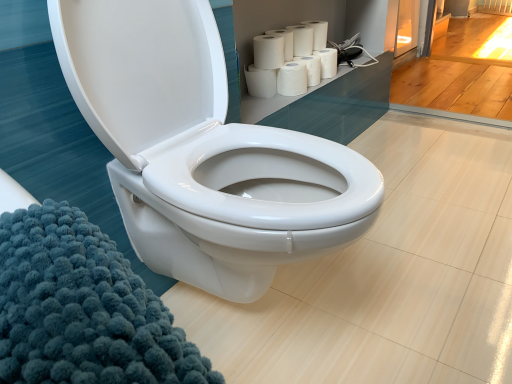
Describe the element at coordinates (311, 69) in the screenshot. I see `white matte paper towel at upper right, which is the third paper towel from bottom to top` at that location.

Locate an element on the screen. The width and height of the screenshot is (512, 384). white matte paper towel at upper center, which appears as the 5th paper towel when viewed from the top is located at coordinates (292, 79).

Locate an element on the screen. The height and width of the screenshot is (384, 512). white matte toilet paper at upper right, arranged as the 1th toilet paper when ordered from the bottom is located at coordinates (327, 62).

What do you see at coordinates (284, 41) in the screenshot? This screenshot has width=512, height=384. I see `white matte paper towel at upper center, the 2th paper towel when ordered from top to bottom` at bounding box center [284, 41].

You are a GUI agent. You are given a task and a screenshot of the screen. Output one action in this format:
    pyautogui.click(x=<x>, y=<y>)
    Task: Click on the white matte paper towel at upper right, which is counted as the 1th paper towel, starting from the bottom
    The width and height of the screenshot is (512, 384).
    Given the screenshot: What is the action you would take?
    pyautogui.click(x=261, y=81)

The image size is (512, 384). Describe the element at coordinates (318, 33) in the screenshot. I see `white matte toilet paper at upper center, which is the first toilet paper from top to bottom` at that location.

You are a GUI agent. You are given a task and a screenshot of the screen. Output one action in this format:
    pyautogui.click(x=<x>, y=<y>)
    Task: Click on the white glossy toilet at center
    Image resolution: width=512 pixels, height=384 pixels.
    Given the screenshot: What is the action you would take?
    pyautogui.click(x=203, y=151)

Can you tell me how much white matte paper towel at upper center, which appears as the 5th paper towel when viewed from the top, and white matte paper towel at upper center, placed as the 1th paper towel when sorted from top to bottom, differ in facing direction?

The angular difference between white matte paper towel at upper center, which appears as the 5th paper towel when viewed from the top, and white matte paper towel at upper center, placed as the 1th paper towel when sorted from top to bottom, is 0.000318 degrees.

From a real-world perspective, starting from the white matte paper towel at upper center, which is the second paper towel in bottom-to-top order, which paper towel is the 3rd one vertically above it? Please provide its 2D coordinates.

[(302, 40)]

Is white matte paper towel at upper center, placed as the 1th paper towel when sorted from top to bottom, at the back of white matte paper towel at upper center, which appears as the 5th paper towel when viewed from the top?

No.

Is white matte paper towel at upper right, marked as the sixth paper towel in a top-to-bottom arrangement, positioned far away from white matte paper towel at upper center, which is the second paper towel in bottom-to-top order?

They are positioned close to each other.

From a real-world perspective, which object rests below the other?

In real-world perspective, white matte paper towel at upper right, marked as the sixth paper towel in a top-to-bottom arrangement, is lower.

Can you confirm if white matte paper towel at upper right, marked as the sixth paper towel in a top-to-bottom arrangement, is thinner than white matte paper towel at upper center, which is the second paper towel in bottom-to-top order?

No.

Considering the sizes of white matte paper towel at upper right, marked as the sixth paper towel in a top-to-bottom arrangement, and white matte paper towel at upper center, which is the second paper towel in bottom-to-top order, in the image, is white matte paper towel at upper right, marked as the sixth paper towel in a top-to-bottom arrangement, taller or shorter than white matte paper towel at upper center, which is the second paper towel in bottom-to-top order,?

Clearly, white matte paper towel at upper right, marked as the sixth paper towel in a top-to-bottom arrangement, is shorter compared to white matte paper towel at upper center, which is the second paper towel in bottom-to-top order.

Considering the sizes of white matte paper towel at upper center, placed as the 1th paper towel when sorted from top to bottom, and white matte paper towel at upper right, the fourth paper towel positioned from the top, in the image, is white matte paper towel at upper center, placed as the 1th paper towel when sorted from top to bottom, taller or shorter than white matte paper towel at upper right, the fourth paper towel positioned from the top,?

Clearly, white matte paper towel at upper center, placed as the 1th paper towel when sorted from top to bottom, is taller compared to white matte paper towel at upper right, the fourth paper towel positioned from the top.

Is white matte paper towel at upper center, which is the sixth paper towel from bottom to top, to the left or to the right of white matte paper towel at upper right, the fourth paper towel positioned from the top, in the image?

In the image, white matte paper towel at upper center, which is the sixth paper towel from bottom to top, appears on the left side of white matte paper towel at upper right, the fourth paper towel positioned from the top.

Identify the location of paper towel that is the 4th object above the white matte paper towel at upper right, which is the third paper towel from bottom to top (from a real-world perspective). This screenshot has height=384, width=512. (302, 40).

From a real-world perspective, is white glossy toilet at center under white matte paper towel at upper right, marked as the sixth paper towel in a top-to-bottom arrangement?

No.

The width and height of the screenshot is (512, 384). In order to click on toilet below the white matte paper towel at upper right, marked as the sixth paper towel in a top-to-bottom arrangement (from the image's perspective) in this screenshot , I will do `click(203, 151)`.

In the image, is white glossy toilet at center on the left side or the right side of white matte paper towel at upper right, which is counted as the 1th paper towel, starting from the bottom?

In the image, white glossy toilet at center appears on the left side of white matte paper towel at upper right, which is counted as the 1th paper towel, starting from the bottom.

Is white glossy toilet at center turned away from white matte paper towel at upper right, marked as the sixth paper towel in a top-to-bottom arrangement?

white glossy toilet at center is not turned away from white matte paper towel at upper right, marked as the sixth paper towel in a top-to-bottom arrangement.

Which is more to the left, white matte toilet paper at upper center, which is the first toilet paper from top to bottom, or white glossy toilet at center?

white glossy toilet at center.

Which is correct: white matte toilet paper at upper center, which is the first toilet paper from top to bottom, is inside white glossy toilet at center, or outside of it?

white matte toilet paper at upper center, which is the first toilet paper from top to bottom, is not enclosed by white glossy toilet at center.

From a real-world perspective, which object stands above the other?

white matte toilet paper at upper center, which is the 2th toilet paper from bottom to top, from a real-world perspective.

Considering the points (322, 31) and (136, 72), which point is in front, point (322, 31) or point (136, 72)?

The point (136, 72) is more forward.

From the image's perspective, between white glossy toilet at center and white matte paper towel at upper center, which is the sixth paper towel from bottom to top, which one is located above?

white matte paper towel at upper center, which is the sixth paper towel from bottom to top, is shown above in the image.

Which of these two, white glossy toilet at center or white matte paper towel at upper center, placed as the 1th paper towel when sorted from top to bottom, is smaller?

Smaller between the two is white matte paper towel at upper center, placed as the 1th paper towel when sorted from top to bottom.

Would you say white glossy toilet at center contains white matte paper towel at upper center, which is the sixth paper towel from bottom to top?

No, white matte paper towel at upper center, which is the sixth paper towel from bottom to top, is located outside of white glossy toilet at center.

Between white glossy toilet at center and white matte paper towel at upper center, which is the sixth paper towel from bottom to top, which one has more height?

Standing taller between the two is white glossy toilet at center.

In the scene shown: Is white matte toilet paper at upper right, which is the second toilet paper in top-to-bottom order, touching white glossy toilet at center?

No.

From the image's perspective, is white matte toilet paper at upper right, which is the second toilet paper in top-to-bottom order, over white glossy toilet at center?

Yes.

From the picture: Is white matte toilet paper at upper right, arranged as the 1th toilet paper when ordered from the bottom, situated inside white glossy toilet at center or outside?

white matte toilet paper at upper right, arranged as the 1th toilet paper when ordered from the bottom, is not inside white glossy toilet at center, it's outside.

Is white matte toilet paper at upper right, which is the second toilet paper in top-to-bottom order, bigger than white glossy toilet at center?

No.

From a real-world perspective, which paper towel is the 3rd one underneath the white matte paper towel at upper center, which is the sixth paper towel from bottom to top? Please provide its 2D coordinates.

[(292, 79)]

From the image's perspective, which paper towel is the 1st one above the white matte paper towel at upper right, which is counted as the 1th paper towel, starting from the bottom? Please provide its 2D coordinates.

[(292, 79)]

Estimate the real-world distances between objects in this image. Which object is closer to white matte paper towel at upper center, the 2th paper towel when ordered from top to bottom, white glossy toilet at center or white matte paper towel at upper right, which is counted as the 1th paper towel, starting from the bottom?

Among the two, white matte paper towel at upper right, which is counted as the 1th paper towel, starting from the bottom, is located nearer to white matte paper towel at upper center, the 2th paper towel when ordered from top to bottom.

Looking at the image, which one is located further to white matte paper towel at upper right, which is counted as the 1th paper towel, starting from the bottom, white matte toilet paper at upper center, which is the 2th toilet paper from bottom to top, or white matte paper towel at upper center, which appears as the 5th paper towel when viewed from the top?

white matte toilet paper at upper center, which is the 2th toilet paper from bottom to top.

Looking at the image, which one is located closer to white matte paper towel at upper center, the 5th paper towel when ordered from bottom to top, white glossy toilet at center or white matte paper towel at upper center, which is the second paper towel in bottom-to-top order?

Among the two, white matte paper towel at upper center, which is the second paper towel in bottom-to-top order, is located nearer to white matte paper towel at upper center, the 5th paper towel when ordered from bottom to top.

From the image, which object appears to be nearer to white matte paper towel at upper center, which appears as the 5th paper towel when viewed from the top, white matte paper towel at upper right, which is counted as the 1th paper towel, starting from the bottom, or white matte toilet paper at upper right, arranged as the 1th toilet paper when ordered from the bottom?

white matte paper towel at upper right, which is counted as the 1th paper towel, starting from the bottom, is positioned closer to the anchor white matte paper towel at upper center, which appears as the 5th paper towel when viewed from the top.

Which object lies further to the anchor point white matte paper towel at upper center, which is the sixth paper towel from bottom to top, white matte toilet paper at upper center, which is the 2th toilet paper from bottom to top, or white matte paper towel at upper right, which is the third paper towel from bottom to top?

Among the two, white matte paper towel at upper right, which is the third paper towel from bottom to top, is located further to white matte paper towel at upper center, which is the sixth paper towel from bottom to top.

Looking at the image, which one is located further to white matte paper towel at upper center, which is the second paper towel in bottom-to-top order, white matte paper towel at upper right, which is counted as the 1th paper towel, starting from the bottom, or white matte paper towels at upper right, the third paper towel when ordered from top to bottom?

The object further to white matte paper towel at upper center, which is the second paper towel in bottom-to-top order, is white matte paper towels at upper right, the third paper towel when ordered from top to bottom.

Looking at the image, which one is located further to white matte paper towels at upper right, the third paper towel when ordered from top to bottom, white matte paper towel at upper right, which is counted as the 1th paper towel, starting from the bottom, or white glossy toilet at center?

Based on the image, white glossy toilet at center appears to be further to white matte paper towels at upper right, the third paper towel when ordered from top to bottom.

Based on their spatial positions, is white glossy toilet at center or white matte paper towels at upper right, arranged as the fourth paper towel when ordered from the bottom, further from white matte paper towel at upper right, which is the third paper towel from bottom to top?

Based on the image, white glossy toilet at center appears to be further to white matte paper towel at upper right, which is the third paper towel from bottom to top.

At what (x,y) coordinates should I click in order to perform the action: click on toilet paper between white glossy toilet at center and white matte toilet paper at upper center, which is the 2th toilet paper from bottom to top, from front to back. Please return your answer as a coordinate pair (x, y). The height and width of the screenshot is (384, 512). Looking at the image, I should click on (327, 62).

The height and width of the screenshot is (384, 512). I want to click on toilet paper located between white matte paper towels at upper right, the third paper towel when ordered from top to bottom, and white matte toilet paper at upper center, which is the first toilet paper from top to bottom, in the depth direction, so click(327, 62).

The image size is (512, 384). Identify the location of toilet paper between white matte paper towel at upper center, the 5th paper towel when ordered from bottom to top, and white matte toilet paper at upper right, which is the second toilet paper in top-to-bottom order, in the horizontal direction. (318, 33).

The height and width of the screenshot is (384, 512). What are the coordinates of `toilet paper between white matte toilet paper at upper center, which is the first toilet paper from top to bottom, and white matte paper towel at upper center, which appears as the 5th paper towel when viewed from the top, vertically` in the screenshot? It's located at (327, 62).